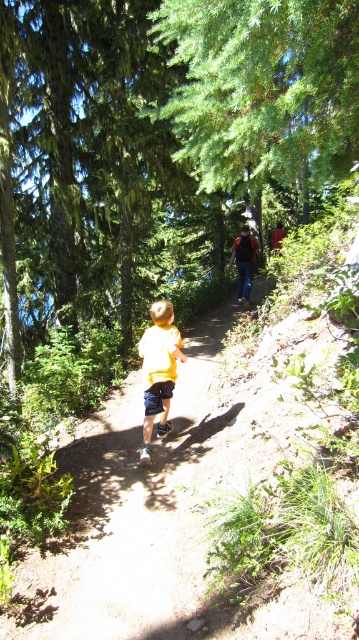
Question: Which of the following is the farthest from the observer?

Choices:
 (A) (90, 600)
 (B) (179, 48)
 (C) (161, 412)

Answer: (C)

Question: Does yellow fabric child at center appear on the right side of yellow matte shirt at center?

Choices:
 (A) yes
 (B) no

Answer: (B)

Question: Which object is positioned closest to the green leafy tree at upper center?

Choices:
 (A) yellow matte shirt at center
 (B) yellow fabric child at center

Answer: (A)

Question: Which of the following is the farthest from the observer?

Choices:
 (A) green leafy tree at upper center
 (B) yellow fabric child at center

Answer: (B)

Question: From the image, what is the correct spatial relationship of green leafy tree at upper center in relation to yellow matte shirt at center?

Choices:
 (A) above
 (B) below

Answer: (A)

Question: Is yellow fabric child at center bigger than green leafy tree at upper center?

Choices:
 (A) yes
 (B) no

Answer: (B)